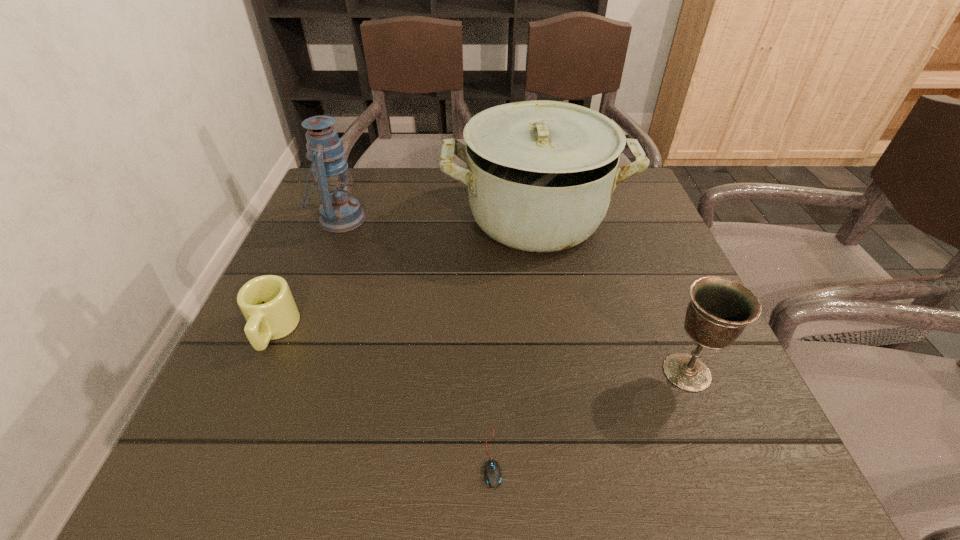
Find the location of a particular element. Image resolution: width=960 pixels, height=540 pixels. vacant point located on the left of the nearest object is located at coordinates (332, 457).

This screenshot has height=540, width=960. Identify the location of lantern that is at the far edge. (339, 212).

Find the location of a particular element. Image resolution: width=960 pixels, height=540 pixels. saucepan located at the far edge is located at coordinates (540, 174).

Identify the location of object present at the near edge. (492, 475).

What are the coordinates of `lantern present at the left edge` in the screenshot? It's located at click(339, 212).

Identify the location of mug situated at the left edge. The height and width of the screenshot is (540, 960). (266, 302).

At what (x,y) coordinates should I click in order to perform the action: click on saucepan that is at the right edge. Please return your answer as a coordinate pair (x, y). Looking at the image, I should click on (540, 174).

The width and height of the screenshot is (960, 540). Find the location of `chalice positioned at the right edge`. chalice positioned at the right edge is located at coordinates (719, 310).

At what (x,y) coordinates should I click in order to perform the action: click on object present at the far left corner. Please return your answer as a coordinate pair (x, y). This screenshot has height=540, width=960. Looking at the image, I should click on (339, 212).

This screenshot has height=540, width=960. Find the location of `object located at the far right corner`. object located at the far right corner is located at coordinates (540, 174).